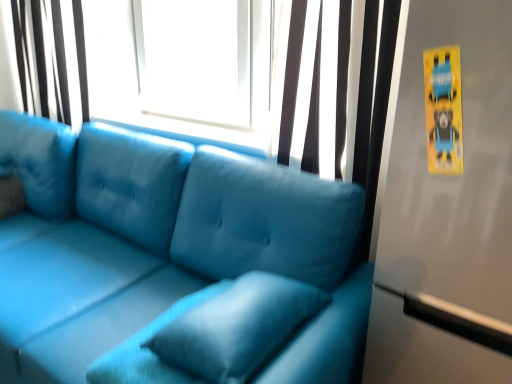
Question: Considering the relative sizes of matte black curtain at upper center, acting as the 2th curtain starting from the left, and matte blue couch at center in the image provided, is matte black curtain at upper center, acting as the 2th curtain starting from the left, shorter than matte blue couch at center?

Choices:
 (A) yes
 (B) no

Answer: (A)

Question: From the image's perspective, is matte black curtain at upper center, acting as the 2th curtain starting from the left, located above matte blue couch at center?

Choices:
 (A) yes
 (B) no

Answer: (A)

Question: Considering the relative sizes of matte black curtain at upper center, acting as the 2th curtain starting from the left, and matte blue couch at center in the image provided, is matte black curtain at upper center, acting as the 2th curtain starting from the left, smaller than matte blue couch at center?

Choices:
 (A) no
 (B) yes

Answer: (B)

Question: Does matte black curtain at upper center, the second curtain viewed from the back, appear on the left side of matte blue couch at center?

Choices:
 (A) yes
 (B) no

Answer: (B)

Question: Is matte black curtain at upper center, positioned as the 1th curtain in right-to-left order, oriented towards matte blue couch at center?

Choices:
 (A) yes
 (B) no

Answer: (A)

Question: Is velvet blue pillow at center bigger or smaller than matte black curtain at upper center, the second curtain viewed from the back?

Choices:
 (A) small
 (B) big

Answer: (A)

Question: From a real-world perspective, is velvet blue pillow at center above or below matte black curtain at upper center, the second curtain viewed from the back?

Choices:
 (A) below
 (B) above

Answer: (A)

Question: Does point (243, 349) appear closer or farther from the camera than point (370, 200)?

Choices:
 (A) farther
 (B) closer

Answer: (B)

Question: Relative to matte black curtain at upper center, which is counted as the 1th curtain, starting from the front, is velvet blue pillow at center in front or behind?

Choices:
 (A) front
 (B) behind

Answer: (A)

Question: Based on their positions, is matte blue couch at center located to the left or right of matte white curtain at upper left, the 2th curtain in the right-to-left sequence?

Choices:
 (A) left
 (B) right

Answer: (B)

Question: Considering their positions, is matte blue couch at center located in front of or behind matte white curtain at upper left, which is counted as the first curtain, starting from the left?

Choices:
 (A) behind
 (B) front

Answer: (B)

Question: From the image's perspective, is matte blue couch at center above or below matte white curtain at upper left, marked as the 1th curtain in a back-to-front arrangement?

Choices:
 (A) above
 (B) below

Answer: (B)

Question: Is matte blue couch at center situated inside matte white curtain at upper left, the 2th curtain in the right-to-left sequence, or outside?

Choices:
 (A) inside
 (B) outside

Answer: (B)

Question: From their relative heights in the image, would you say matte black curtain at upper center, which is counted as the 1th curtain, starting from the front, is taller or shorter than velvet blue pillow at center?

Choices:
 (A) tall
 (B) short

Answer: (A)

Question: Is point (298, 84) closer or farther from the camera than point (165, 327)?

Choices:
 (A) farther
 (B) closer

Answer: (A)